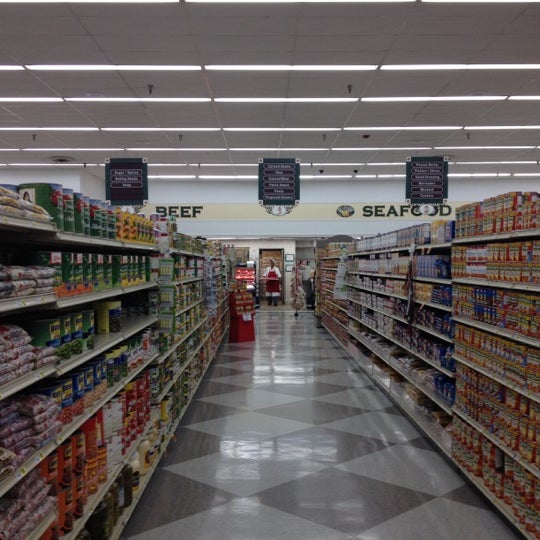
At what (x,y) coordinates should I click in order to perform the action: click on display stand. Please return your answer as a coordinate pair (x, y). Image resolution: width=540 pixels, height=540 pixels. Looking at the image, I should click on (243, 325).